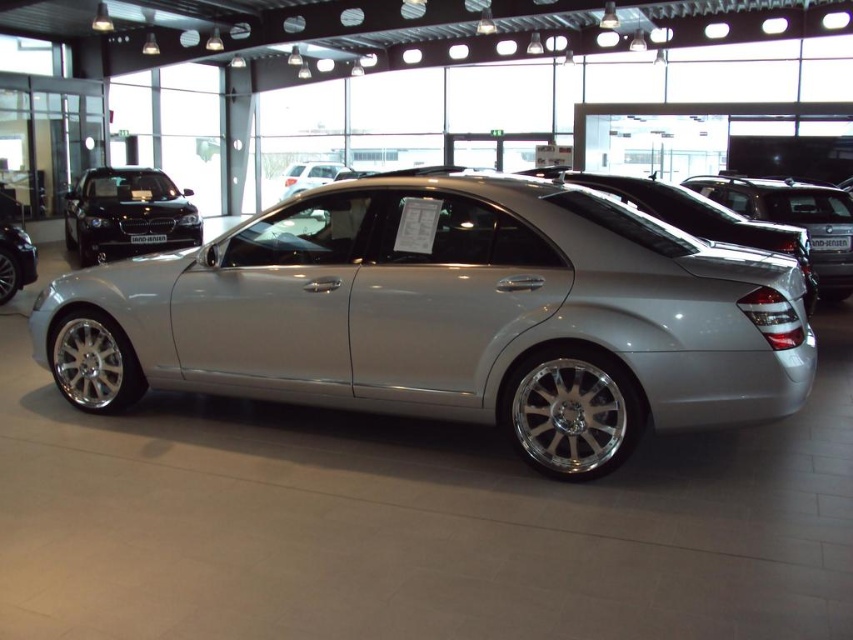
You are standing in a car showroom and want to get a closer look at the shiny black car at left. The showroom has a safety rule that you must stay at least 10 meters away from any vehicle. Can you safely approach the car without violating the rule?

The shiny black car at left is 10.45 meters from the viewer, so you can approach it to within 10 meters while still maintaining the required distance of at least 10 meters.

You are a customer in the showroom and want to inspect the silver metallic car at center and the silver metallic car at left. Which car should you approach first to get a closer look?

You should approach the silver metallic car at center first because it is closer to you than the silver metallic car at left.

You are standing in the showroom and want to reach the point marked at coordinates (482, 176). The sedan is parked between you and that point. Can you walk around the car to reach the point without moving the car?

The point marked at coordinates (482, 176) is 4.05 meters away from you. Since the sedan is parked between you and the point, you can walk around the car to reach the point without moving it, as there is enough space around the vehicle to navigate.